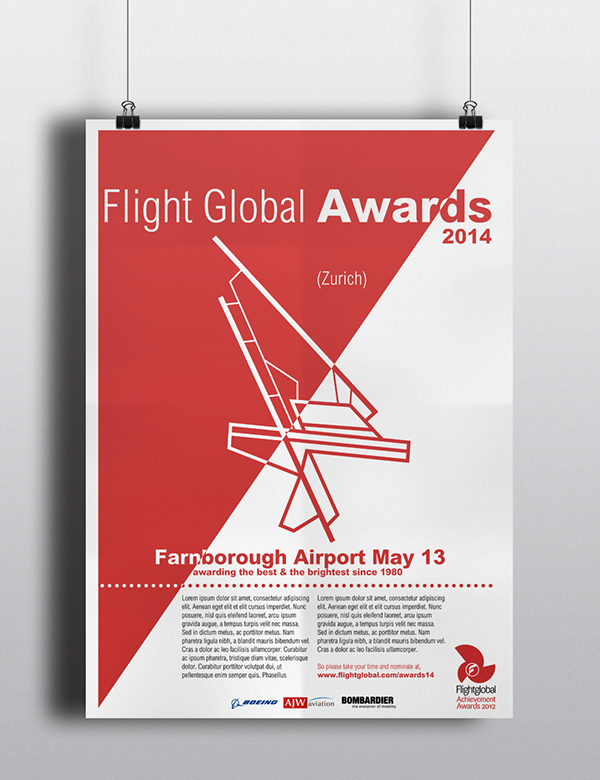
Find the location of `shadow of hanging poster`. shadow of hanging poster is located at coordinates (70, 243).